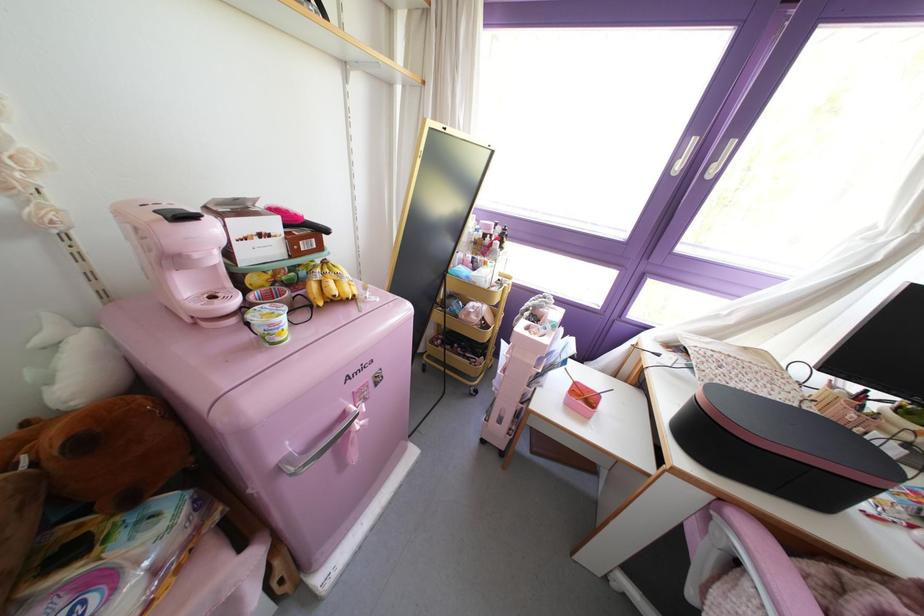
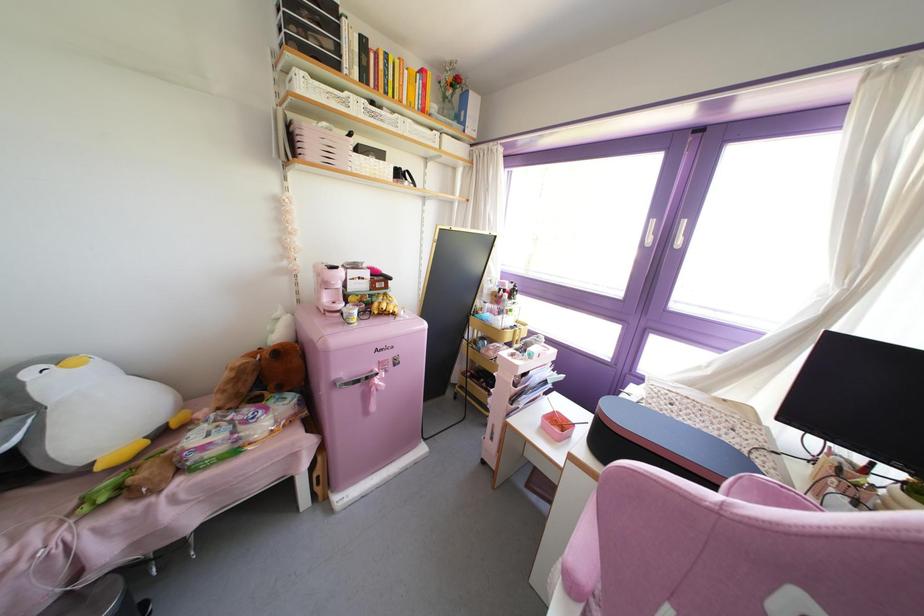
Locate, in the second image, the point that corresponds to (526,313) in the first image.

(516, 345)